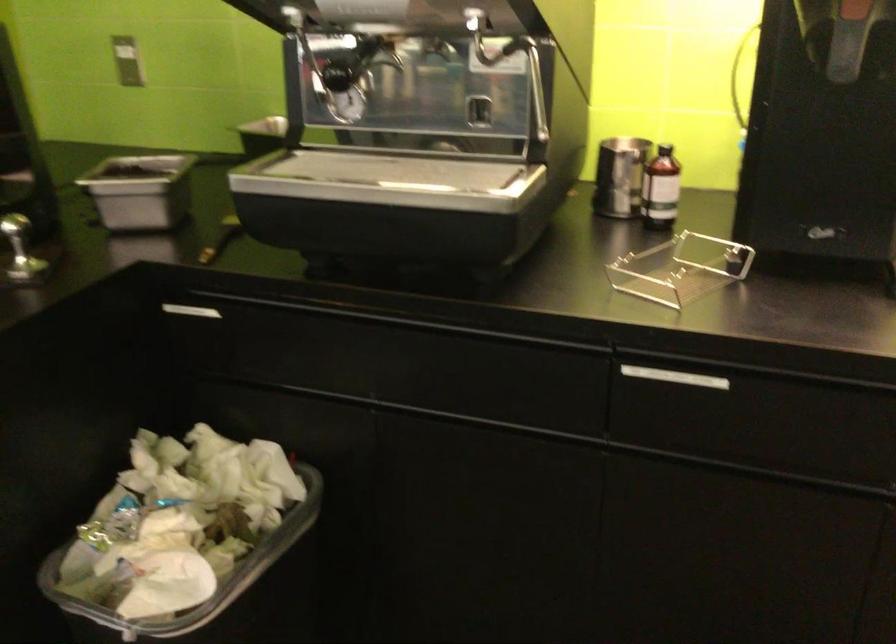
Describe the element at coordinates (513, 64) in the screenshot. I see `a metal machine lever` at that location.